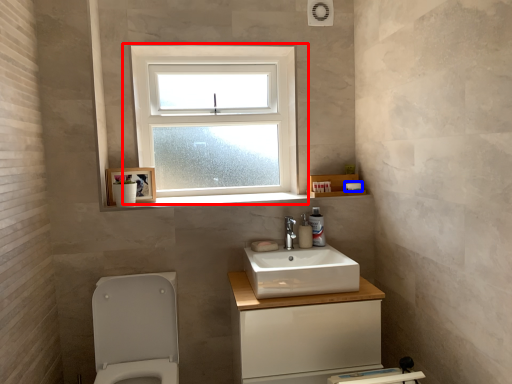
Question: Which object is closer to the camera taking this photo, window (highlighted by a red box) or toilet paper (highlighted by a blue box)?

Choices:
 (A) window
 (B) toilet paper

Answer: (B)